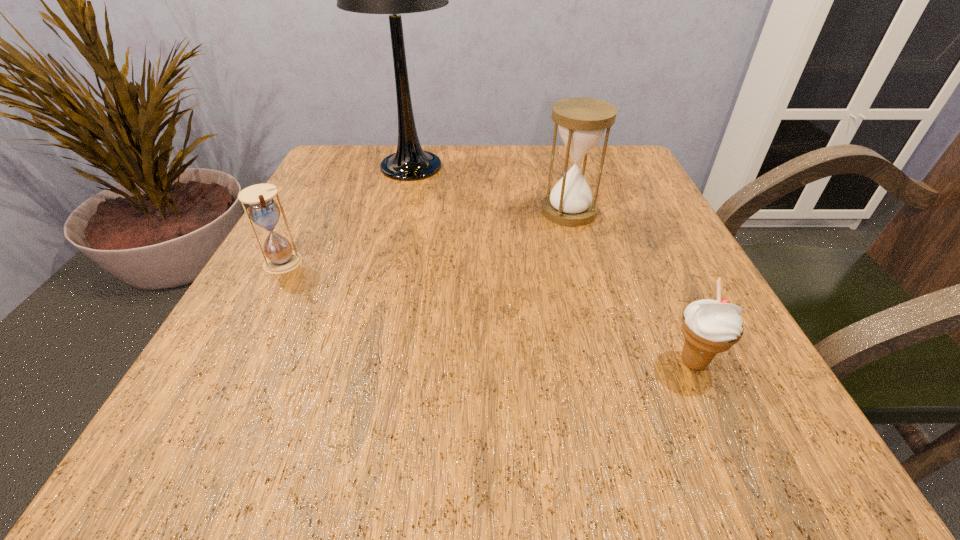
In the image, there is a desktop. Identify the location of vacant space at the left edge. (363, 213).

The width and height of the screenshot is (960, 540). In order to click on vacant position at the right edge of the desktop in this screenshot , I will do `click(740, 408)`.

Identify the location of vacant region at the far left corner. (380, 186).

In the image, there is a desktop. Identify the location of vacant space at the near left corner. (250, 423).

Locate an element on the screen. free point between the second shortest object and the farther hourglass is located at coordinates (425, 238).

The width and height of the screenshot is (960, 540). What are the coordinates of `empty space between the third nearest object and the third tallest object` in the screenshot? It's located at (425, 238).

The height and width of the screenshot is (540, 960). Identify the location of free space that is in between the icecream and the leftmost object. (488, 313).

The width and height of the screenshot is (960, 540). I want to click on free point between the second farthest object and the table lamp, so click(490, 189).

You are a GUI agent. You are given a task and a screenshot of the screen. Output one action in this format:
    pyautogui.click(x=<x>, y=<y>)
    Task: Click on the blank region between the farthest object and the rightmost object
    Image resolution: width=960 pixels, height=540 pixels.
    Given the screenshot: What is the action you would take?
    pyautogui.click(x=552, y=264)

I want to click on vacant area between the farther hourglass and the tallest object, so click(490, 189).